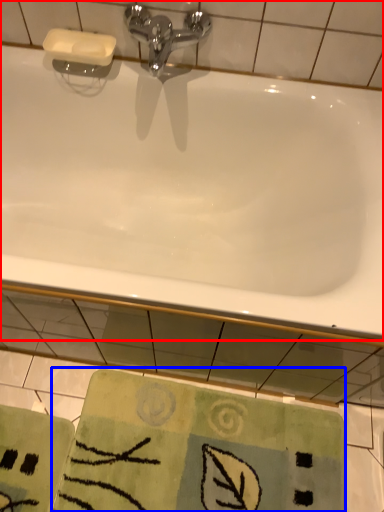
Question: Which point is closer to the camera, bathtub (highlighted by a red box) or beach towel (highlighted by a blue box)?

Choices:
 (A) bathtub
 (B) beach towel

Answer: (A)